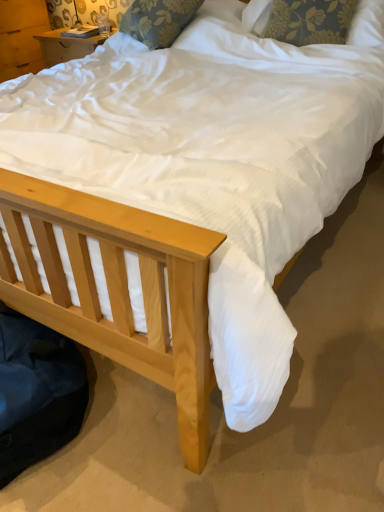
Question: Would you say floral fabric pillow at upper center, the second pillow in the left-to-right sequence, is to the left or to the right of floral fabric pillow at upper center, marked as the 1th pillow in a left-to-right arrangement, in the picture?

Choices:
 (A) right
 (B) left

Answer: (A)

Question: Is floral fabric pillow at upper center, the second pillow in the left-to-right sequence, bigger or smaller than floral fabric pillow at upper center, marked as the 1th pillow in a left-to-right arrangement?

Choices:
 (A) small
 (B) big

Answer: (A)

Question: Is floral fabric pillow at upper center, acting as the first pillow starting from the right, wider or thinner than floral fabric pillow at upper center, acting as the second pillow starting from the right?

Choices:
 (A) wide
 (B) thin

Answer: (B)

Question: From a real-world perspective, is floral fabric pillow at upper center, acting as the second pillow starting from the right, above or below floral fabric pillow at upper center, acting as the first pillow starting from the right?

Choices:
 (A) below
 (B) above

Answer: (B)

Question: Considering the positions of floral fabric pillow at upper center, marked as the 1th pillow in a left-to-right arrangement, and floral fabric pillow at upper center, acting as the first pillow starting from the right, in the image, is floral fabric pillow at upper center, marked as the 1th pillow in a left-to-right arrangement, wider or thinner than floral fabric pillow at upper center, acting as the first pillow starting from the right,?

Choices:
 (A) thin
 (B) wide

Answer: (B)

Question: From the image's perspective, is floral fabric pillow at upper center, acting as the second pillow starting from the right, above or below floral fabric pillow at upper center, the second pillow in the left-to-right sequence?

Choices:
 (A) above
 (B) below

Answer: (A)

Question: Is floral fabric pillow at upper center, marked as the 1th pillow in a left-to-right arrangement, spatially inside floral fabric pillow at upper center, acting as the first pillow starting from the right, or outside of it?

Choices:
 (A) outside
 (B) inside

Answer: (A)